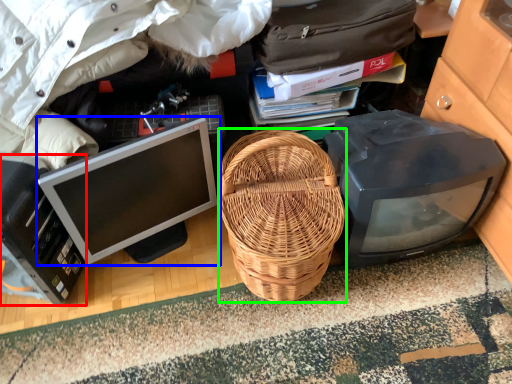
Question: Estimate the real-world distances between objects in this image. Which object is farther from computer (highlighted by a red box), computer monitor (highlighted by a blue box) or picnic basket (highlighted by a green box)?

Choices:
 (A) computer monitor
 (B) picnic basket

Answer: (B)